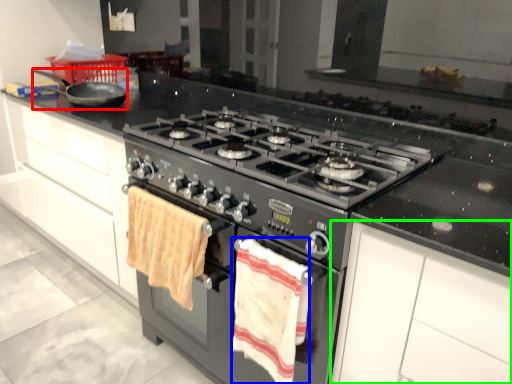
Question: Which object is positioned farthest from frying pan (highlighted by a red box)? Select from beach towel (highlighted by a blue box) and cabinetry (highlighted by a green box).

Choices:
 (A) beach towel
 (B) cabinetry

Answer: (B)